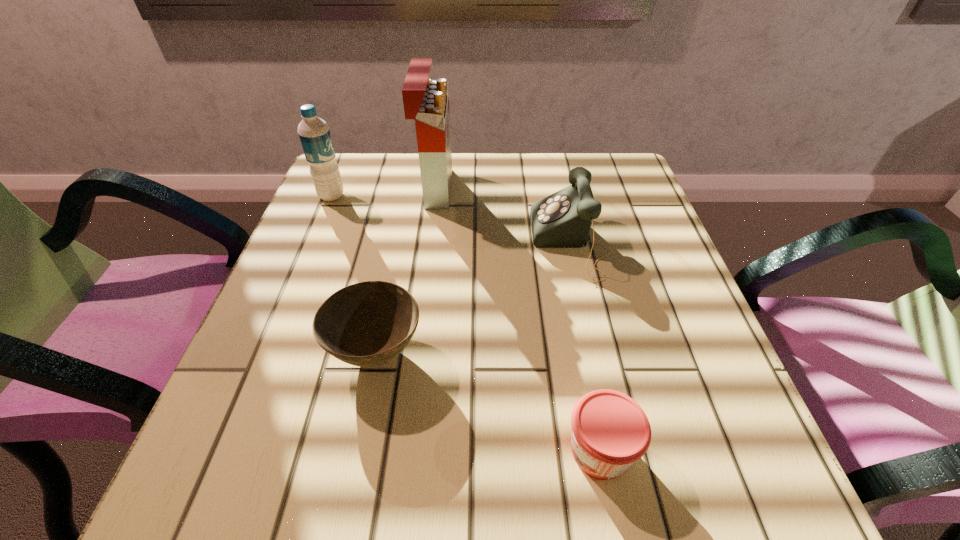
The width and height of the screenshot is (960, 540). I want to click on cigarette case, so click(426, 100).

Locate an element on the screen. the leftmost object is located at coordinates (314, 133).

What are the coordinates of `water bottle` in the screenshot? It's located at (314, 133).

Locate an element on the screen. telephone is located at coordinates (563, 219).

This screenshot has height=540, width=960. Find the location of `the fourth farthest object`. the fourth farthest object is located at coordinates (367, 324).

Where is `jam`? This screenshot has width=960, height=540. jam is located at coordinates (610, 431).

This screenshot has height=540, width=960. Identify the location of vacant region located with the lid open on the tallest object. (590, 188).

What are the coordinates of `vacant region located on the label of the second tallest object` in the screenshot? It's located at (393, 195).

Identify the location of vacant space located on the dial of the telephone. Image resolution: width=960 pixels, height=540 pixels. (484, 243).

What are the coordinates of `vacant area located on the dial of the telephone` in the screenshot? It's located at (499, 243).